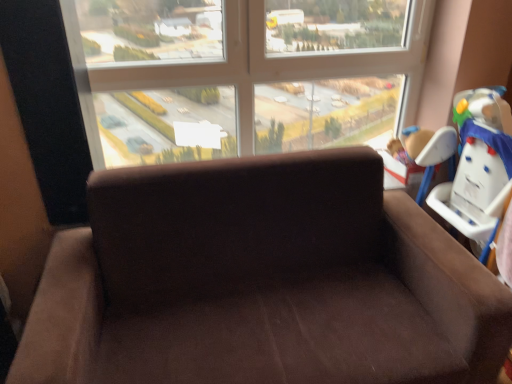
Question: Would you say transparent glass window at upper center is inside or outside brown plush toy at upper right?

Choices:
 (A) outside
 (B) inside

Answer: (A)

Question: From a real-world perspective, is transparent glass window at upper center above or below brown plush toy at upper right?

Choices:
 (A) below
 (B) above

Answer: (B)

Question: Which object is positioned closest to the brown plush toy at upper right?

Choices:
 (A) white plastic baby carriage at right
 (B) transparent glass window at upper center
 (C) suede brown couch at center

Answer: (A)

Question: Estimate the real-world distances between objects in this image. Which object is closer to the suede brown couch at center?

Choices:
 (A) transparent glass window at upper center
 (B) white plastic baby carriage at right
 (C) brown plush toy at upper right

Answer: (B)